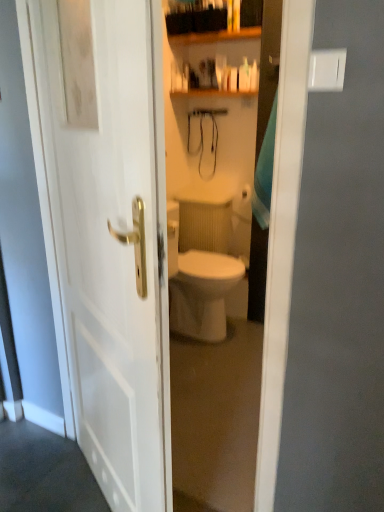
Question: In the image, is white glossy soap dispenser at upper center positioned in front of or behind white glossy door at center?

Choices:
 (A) behind
 (B) front

Answer: (A)

Question: From a real-world perspective, is white glossy soap dispenser at upper center physically located above or below white glossy door at center?

Choices:
 (A) below
 (B) above

Answer: (B)

Question: In terms of size, does white glossy soap dispenser at upper center appear bigger or smaller than white glossy door at center?

Choices:
 (A) big
 (B) small

Answer: (B)

Question: Relative to white glossy soap dispenser at upper center, is white glossy door at center in front or behind?

Choices:
 (A) behind
 (B) front

Answer: (B)

Question: Is white glossy door at center taller or shorter than white glossy soap dispenser at upper center?

Choices:
 (A) short
 (B) tall

Answer: (B)

Question: From the image's perspective, is white glossy door at center above or below white glossy soap dispenser at upper center?

Choices:
 (A) above
 (B) below

Answer: (B)

Question: In the image, is white glossy door at center on the left side or the right side of white glossy soap dispenser at upper center?

Choices:
 (A) left
 (B) right

Answer: (A)